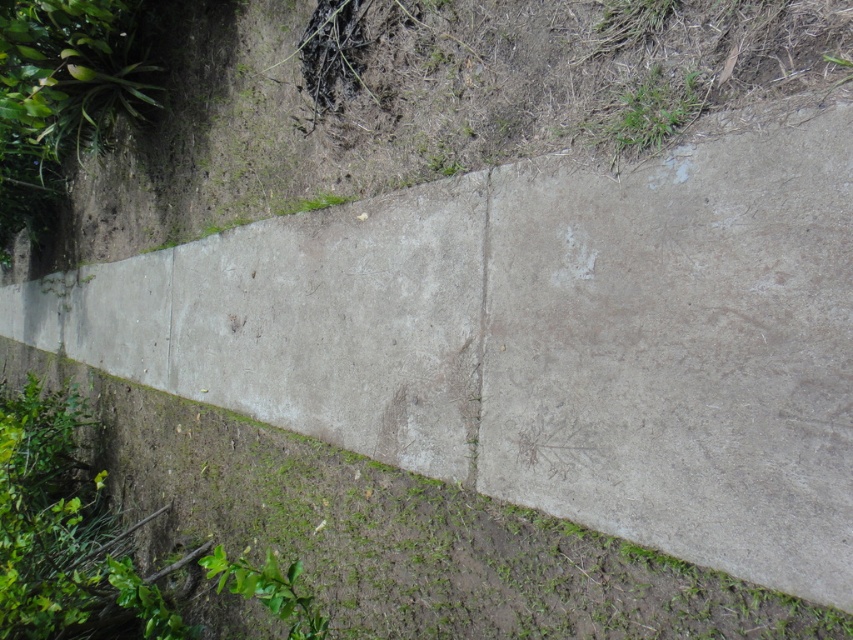
Which of these two, rough concrete at upper left or gray concrete crack at center, stands taller?

With more height is rough concrete at upper left.

Does rough concrete at upper left have a lesser height compared to gray concrete crack at center?

In fact, rough concrete at upper left may be taller than gray concrete crack at center.

This screenshot has width=853, height=640. What are the coordinates of `rough concrete at upper left` in the screenshot? It's located at [x=408, y=100].

Does rough concrete at upper left have a smaller size compared to green grass at upper right?

No.

Is rough concrete at upper left in front of green grass at upper right?

Yes, rough concrete at upper left is in front of green grass at upper right.

Who is more forward, (271, 161) or (631, 81)?

Point (631, 81) is more forward.

This screenshot has width=853, height=640. Identify the location of rough concrete at upper left. (408, 100).

Between green grass at upper right and green leafy plant at lower left, which one is positioned lower?

green leafy plant at lower left is lower down.

Does green grass at upper right come behind green leafy plant at lower left?

No, green grass at upper right is closer to the viewer.

In the scene shown: Measure the distance between point [618,115] and camera.

1.94 meters

I want to click on green grass at upper right, so tap(648, 109).